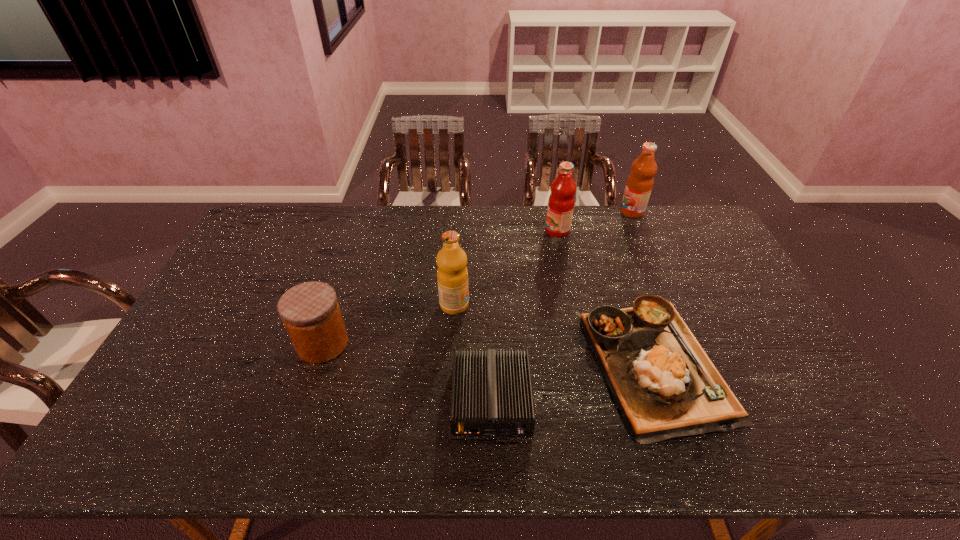
Locate an element on the screen. This screenshot has width=960, height=540. free region at the far edge of the desktop is located at coordinates (384, 224).

Locate an element on the screen. The height and width of the screenshot is (540, 960). vacant space at the near edge of the desktop is located at coordinates (739, 436).

Find the location of `free region at the left edge`. free region at the left edge is located at coordinates (232, 303).

Where is `free space at the right edge of the desktop`? The width and height of the screenshot is (960, 540). free space at the right edge of the desktop is located at coordinates (756, 364).

In the image, there is a desktop. Identify the location of vacant space at the far left corner. This screenshot has height=540, width=960. (273, 231).

What are the coordinates of `free space at the near right corner of the desktop` in the screenshot? It's located at (818, 439).

This screenshot has width=960, height=540. What are the coordinates of `vacant space that is in between the second fruit juice from right to left and the farthest object` in the screenshot? It's located at (594, 221).

This screenshot has height=540, width=960. I want to click on empty space between the leftmost object and the nearest fruit juice, so click(x=389, y=324).

Locate an element on the screen. The height and width of the screenshot is (540, 960). free space between the leftmost fruit juice and the platter is located at coordinates (554, 334).

Where is `free spot between the rightmost fruit juice and the platter`? This screenshot has height=540, width=960. free spot between the rightmost fruit juice and the platter is located at coordinates (642, 287).